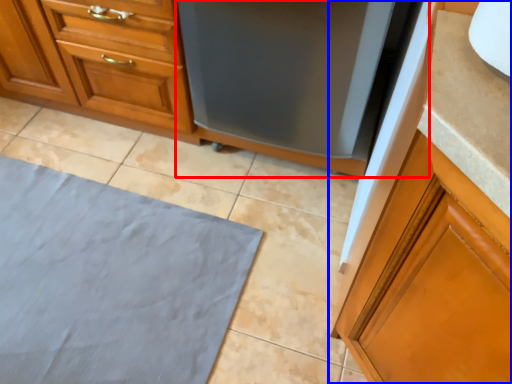
Question: Which object is closer to the camera taking this photo, appliance (highlighted by a red box) or cabinetry (highlighted by a blue box)?

Choices:
 (A) appliance
 (B) cabinetry

Answer: (B)